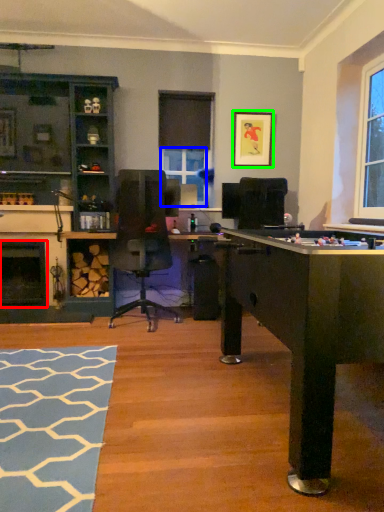
Question: Based on their relative distances, which object is farther from fireplace (highlighted by a red box)? Choose from window screen (highlighted by a blue box) and picture frame (highlighted by a green box).

Choices:
 (A) window screen
 (B) picture frame

Answer: (B)